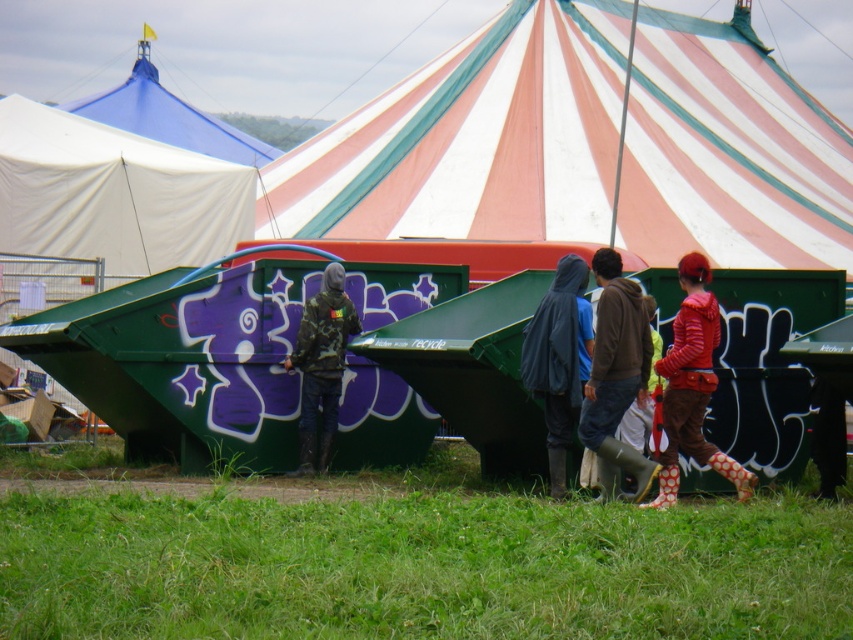
Question: Is striped hoodie at center positioned in front of dark blue hooded jacket at center?

Choices:
 (A) yes
 (B) no

Answer: (B)

Question: Which point appears farthest from the camera in this image?

Choices:
 (A) (305, 362)
 (B) (202, 147)
 (C) (646, 394)
 (D) (459, 504)

Answer: (B)

Question: Considering the relative positions of striped canvas tent at center and brown leather jacket at center in the image provided, where is striped canvas tent at center located with respect to brown leather jacket at center?

Choices:
 (A) left
 (B) right

Answer: (B)

Question: Does green grass at lower center appear over blue fabric canopy at upper left?

Choices:
 (A) no
 (B) yes

Answer: (A)

Question: Among these objects, which one is nearest to the camera?

Choices:
 (A) green grass at lower center
 (B) camo jacket at center
 (C) dark blue hooded jacket at center
 (D) brown leather jacket at center

Answer: (A)

Question: Which is nearer to the striped hoodie at center?

Choices:
 (A) striped canvas tent at center
 (B) dark blue hooded jacket at center
 (C) camo jacket at center

Answer: (B)